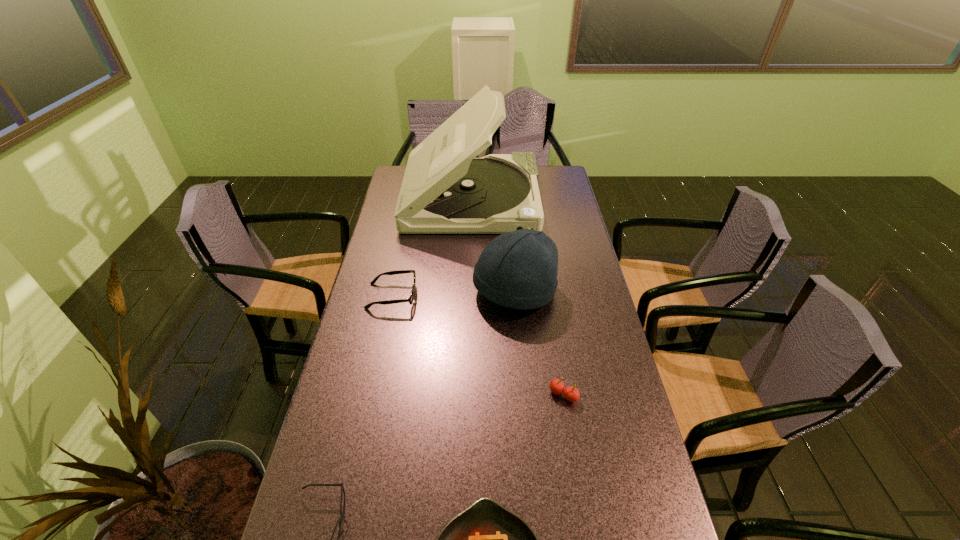
Locate an element on the screen. This screenshot has width=960, height=540. vacant space positioned 0.050m on the lenses of the taller spectacles is located at coordinates (431, 296).

Where is `object at the far edge`? The image size is (960, 540). object at the far edge is located at coordinates coord(445,190).

In order to click on CD player that is at the left edge in this screenshot , I will do `click(445, 190)`.

Find the location of a particular element. The height and width of the screenshot is (540, 960). spectacles that is at the left edge is located at coordinates (410, 299).

Image resolution: width=960 pixels, height=540 pixels. Find the location of `CD player that is at the right edge`. CD player that is at the right edge is located at coordinates (445, 190).

You are a GUI agent. You are given a task and a screenshot of the screen. Output one action in this format:
    pyautogui.click(x=<x>, y=<y>)
    Task: Click on the skullcap situated at the right edge
    
    Given the screenshot: What is the action you would take?
    pyautogui.click(x=518, y=269)

Image resolution: width=960 pixels, height=540 pixels. I want to click on cherry present at the right edge, so click(570, 393).

You are a GUI agent. You are given a task and a screenshot of the screen. Output one action in this format:
    pyautogui.click(x=<x>, y=<y>)
    Task: Click on the object present at the far left corner
    The height and width of the screenshot is (540, 960).
    Given the screenshot: What is the action you would take?
    pyautogui.click(x=445, y=190)

Find the location of a particular element. object present at the far right corner is located at coordinates [x=445, y=190].

The image size is (960, 540). I want to click on vacant space at the left edge, so click(x=375, y=348).